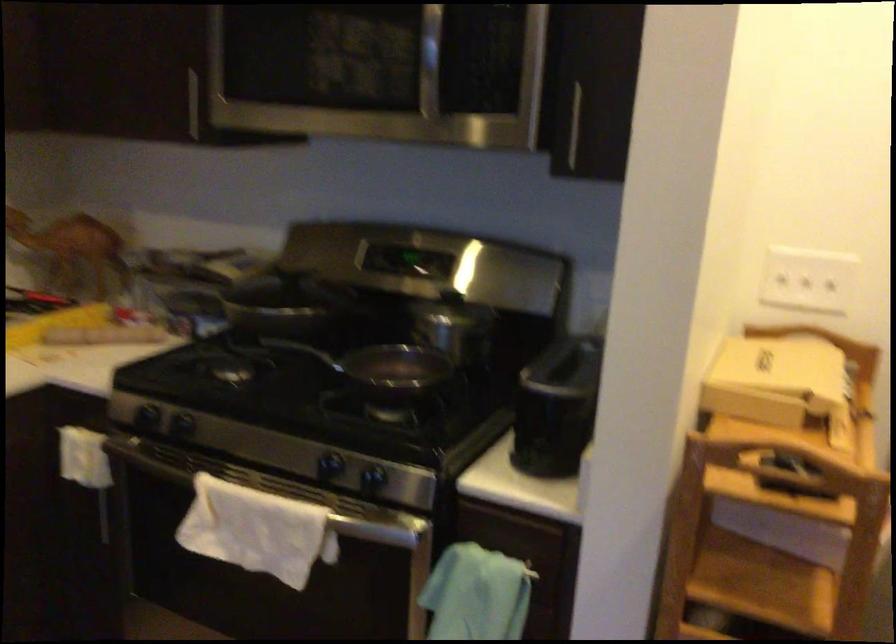
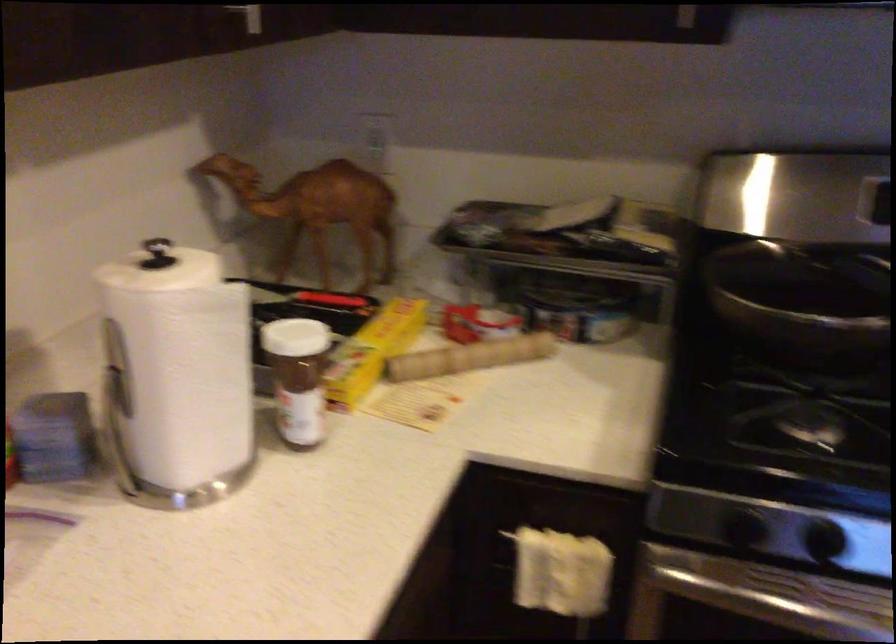
The point at [100,328] is marked in the first image. Where is the corresponding point in the second image?

(469, 357)